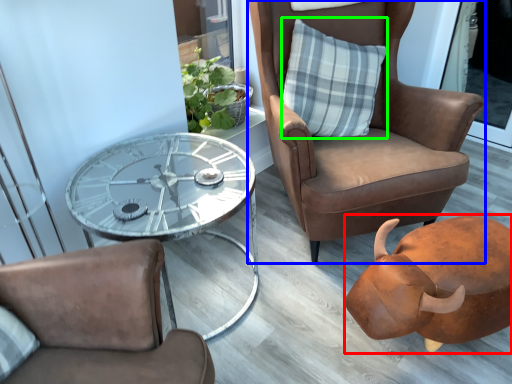
Question: Based on their relative distances, which object is nearer to piggy bank (highlighted by a red box)? Choose from chair (highlighted by a blue box) and pillow (highlighted by a green box).

Choices:
 (A) chair
 (B) pillow

Answer: (A)